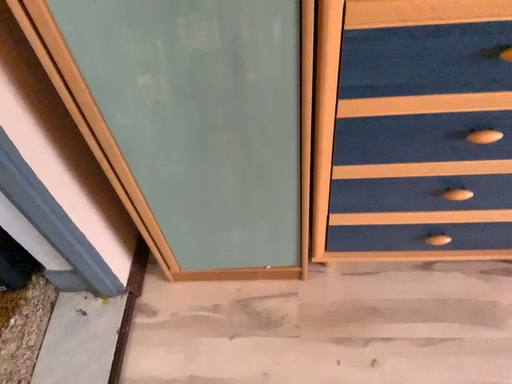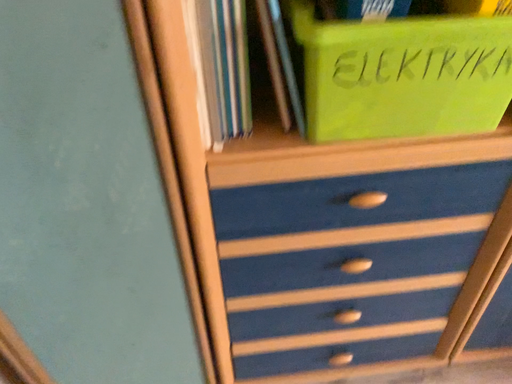
Question: How did the camera likely rotate when shooting the video?

Choices:
 (A) rotated upward
 (B) rotated downward

Answer: (A)